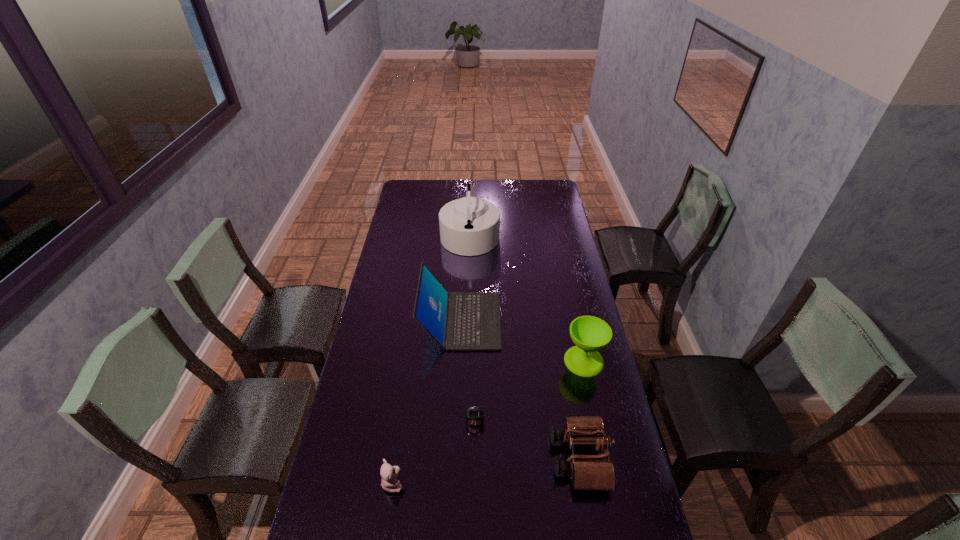
The height and width of the screenshot is (540, 960). I want to click on blank region between the laptop computer and the teddy bear, so click(427, 402).

Identify the location of vacant region between the binoculars and the padlock. The height and width of the screenshot is (540, 960). [x=527, y=440].

Locate an element on the screen. This screenshot has height=540, width=960. the fourth closest object to the laptop computer is located at coordinates (588, 472).

Find the location of `object that is the second closest to the kettle`. object that is the second closest to the kettle is located at coordinates (590, 334).

Where is `free spot that satisfies the following two spatial constraints: 1. on the front of the padlock near the keyhole; 2. at the face of the teddy bear`? The image size is (960, 540). free spot that satisfies the following two spatial constraints: 1. on the front of the padlock near the keyhole; 2. at the face of the teddy bear is located at coordinates (474, 483).

I want to click on free point that satisfies the following two spatial constraints: 1. on the spout of the wineglass; 2. on the right side of the kettle, so click(x=467, y=361).